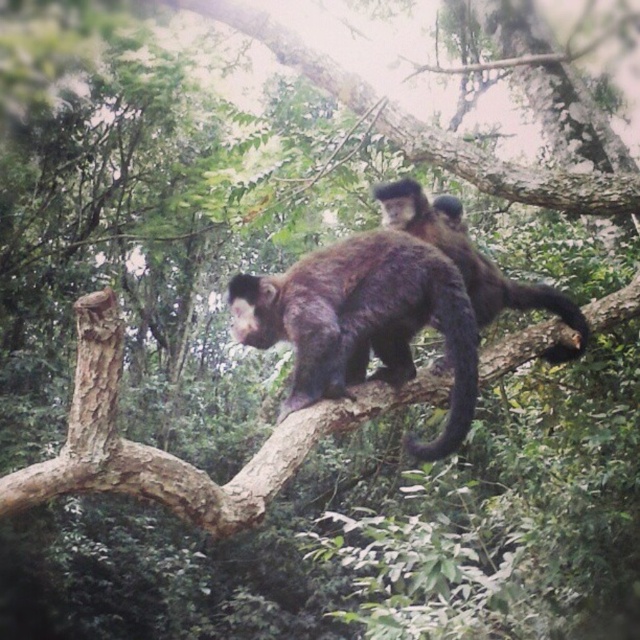
Is black furry tail at center to the right of brown furry tail at upper right from the viewer's perspective?

In fact, black furry tail at center is to the left of brown furry tail at upper right.

This screenshot has width=640, height=640. I want to click on black furry tail at center, so click(451, 355).

Describe the element at coordinates (362, 321) in the screenshot. I see `fuzzy brown monkey at center` at that location.

Is fuzzy brown monkey at center above brown rough tree branch at upper center?

Actually, fuzzy brown monkey at center is below brown rough tree branch at upper center.

This screenshot has width=640, height=640. What do you see at coordinates (362, 321) in the screenshot?
I see `fuzzy brown monkey at center` at bounding box center [362, 321].

At what (x,y) coordinates should I click in order to perform the action: click on fuzzy brown monkey at center. Please return your answer as a coordinate pair (x, y). This screenshot has width=640, height=640. Looking at the image, I should click on (362, 321).

Is shiny brown fur monkey at center to the right of black furry tail at center from the viewer's perspective?

Correct, you'll find shiny brown fur monkey at center to the right of black furry tail at center.

The width and height of the screenshot is (640, 640). I want to click on shiny brown fur monkey at center, so click(x=477, y=266).